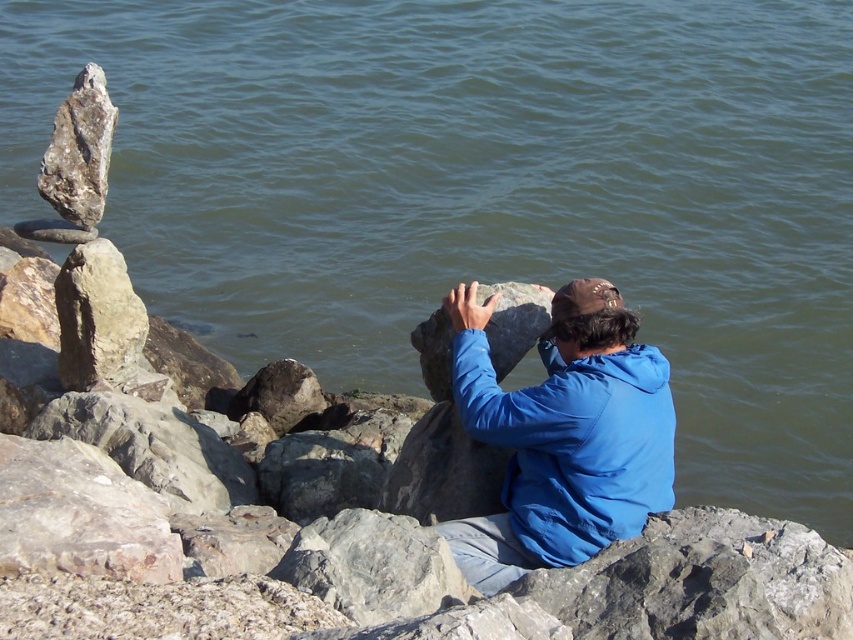
Question: Based on their relative distances, which object is farther from the smooth gray rock at center?

Choices:
 (A) blue fabric jacket at center
 (B) gray rough rock at center

Answer: (B)

Question: Which object appears closest to the camera in this image?

Choices:
 (A) blue fabric jacket at center
 (B) gray rough rock at center
 (C) smooth gray rock at center

Answer: (B)

Question: Can you confirm if gray rough rock at center is positioned above smooth gray rock at center?

Choices:
 (A) yes
 (B) no

Answer: (B)

Question: Does blue fabric jacket at center appear over gray rough rock at center?

Choices:
 (A) yes
 (B) no

Answer: (A)

Question: Is blue fabric jacket at center positioned in front of gray rough rock at center?

Choices:
 (A) yes
 (B) no

Answer: (B)

Question: Which is nearer to the smooth gray rock at center?

Choices:
 (A) blue fabric jacket at center
 (B) gray rough rock at center

Answer: (A)